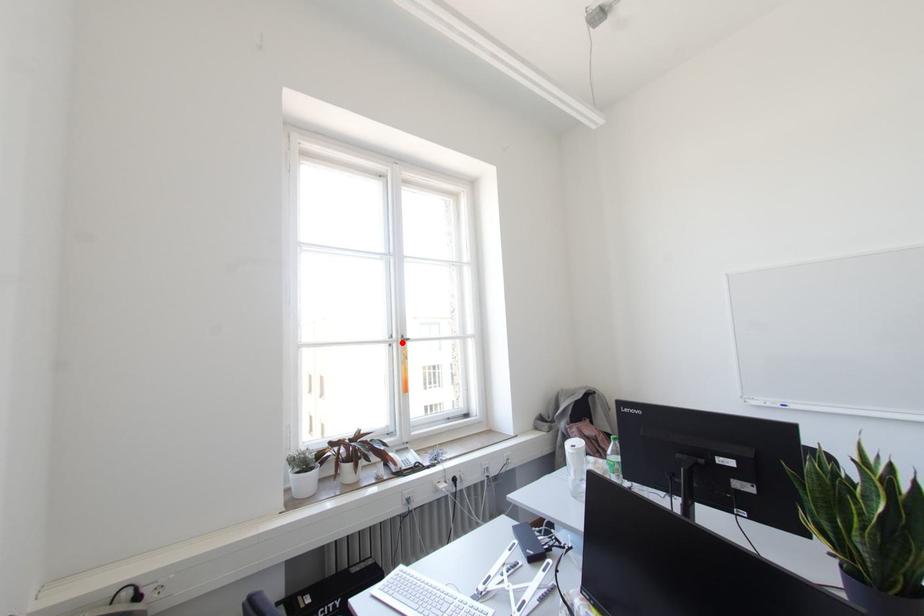
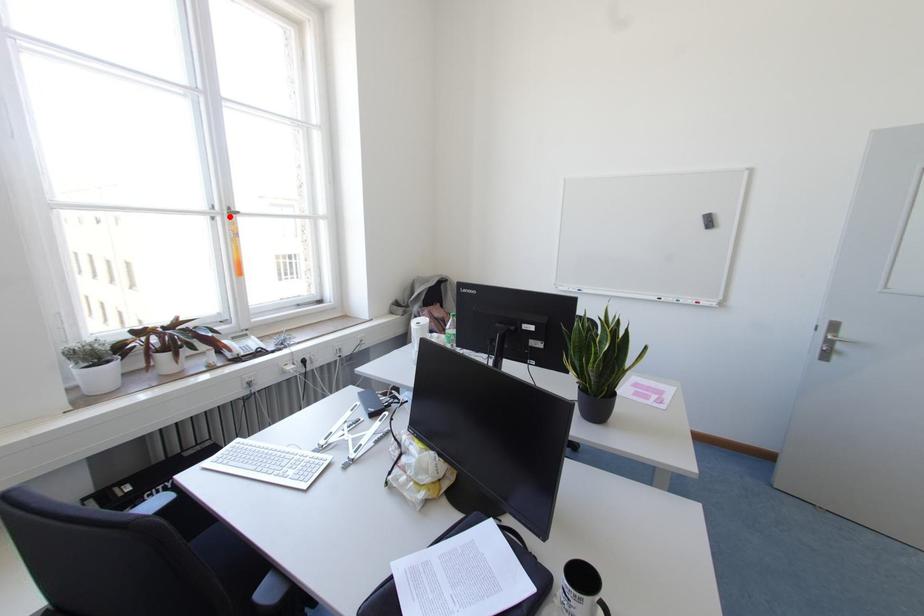
I am providing you with two images of the same scene from different viewpoints. A red point is marked on the first image and another point is marked on the second image. Does the point marked in image1 correspond to the same location as the one in image2?

Yes